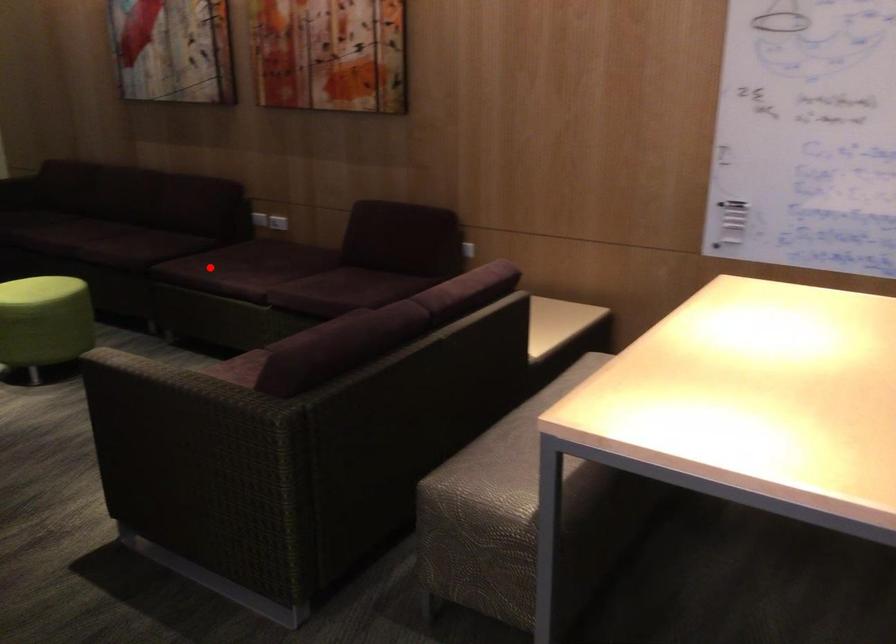
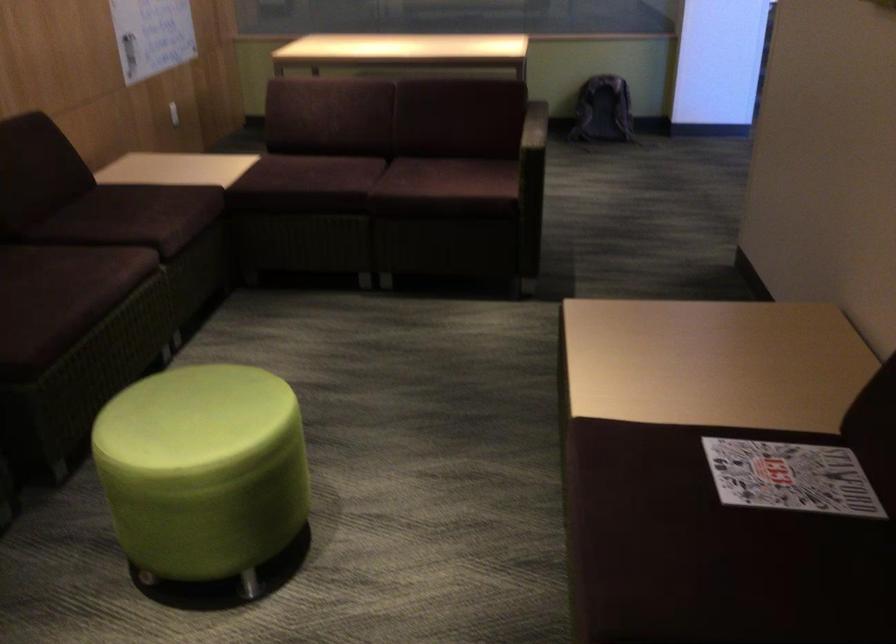
In the second image, find the point that corresponds to the highlighted location in the first image.

(44, 301)